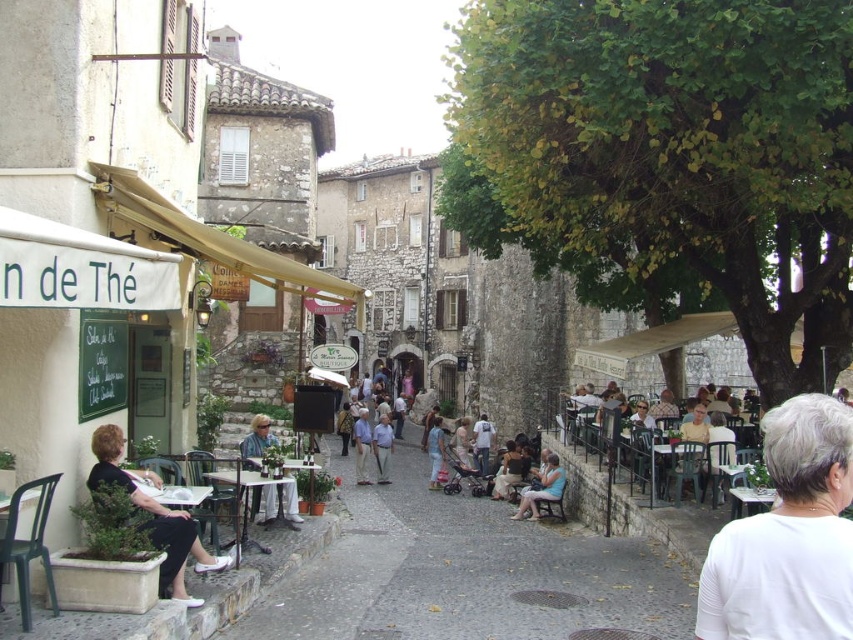
You are a photographer standing in the middle of the cobblestone street in the European town. You notice a light beige fabric coat at center and a light blue shirt at center. Which one is closer to you?

The light beige fabric coat at center is closer to you because it is in front of the light blue shirt at center.

You are a customer at the n de Th? cafe and want to place your light beige fabric coat at center on the light blue fabric chair at lower center. Will the coat fit on the chair without falling off?

The light beige fabric coat at center is larger in size than the light blue fabric chair at lower center, so placing the coat on the chair may cause it to fall off due to the size difference.